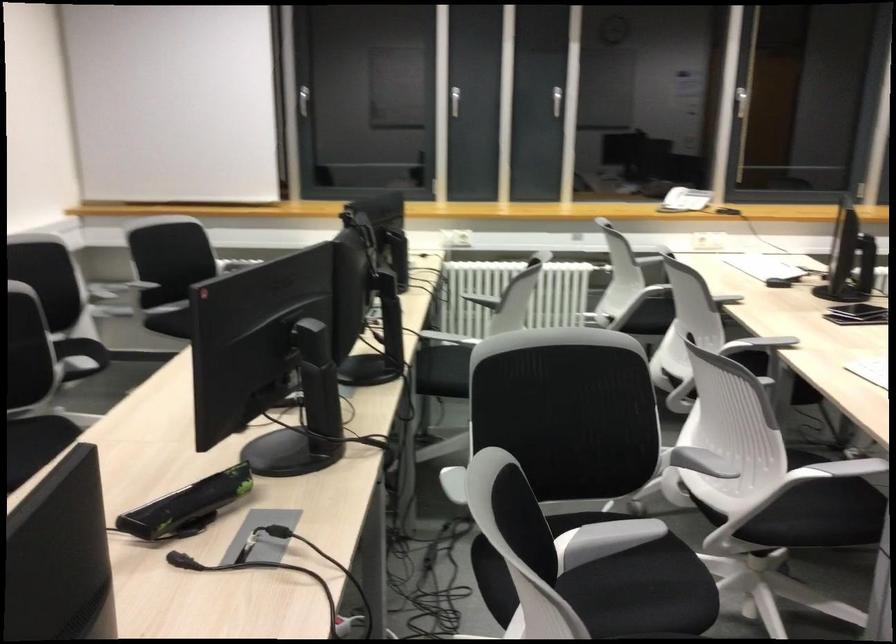
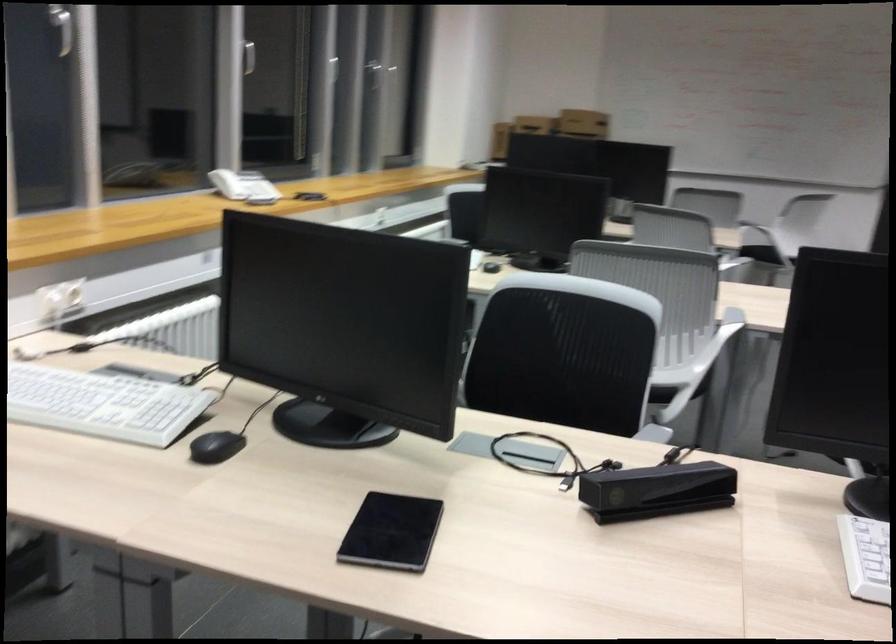
Where in the second image is the point corresponding to pixel 505 298 from the first image?

(564, 353)